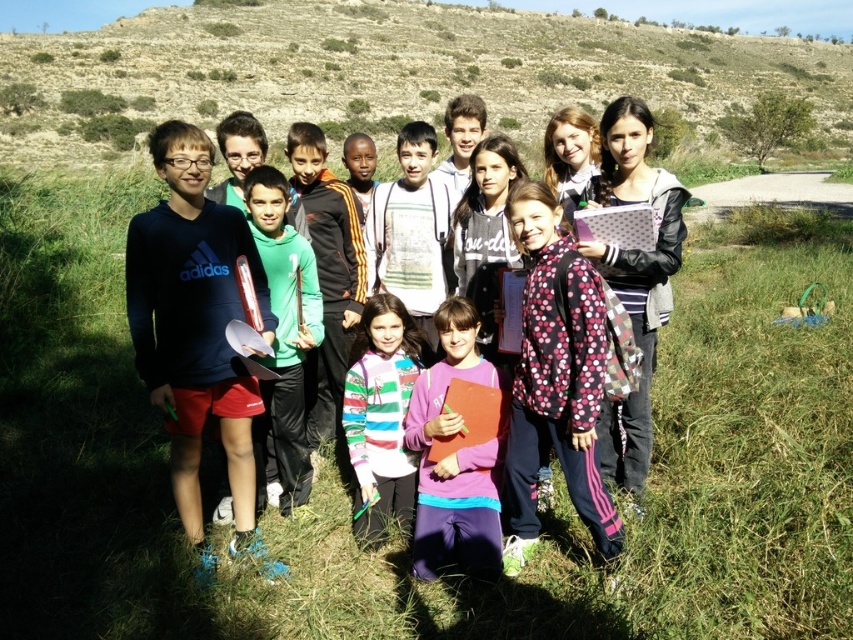
Question: Which point is closer to the camera?

Choices:
 (A) blue adidas shirt at left
 (B) pink polka dot jacket at center

Answer: (B)

Question: Does pink dotted jacket at center have a smaller size compared to green fleece jacket at center?

Choices:
 (A) yes
 (B) no

Answer: (B)

Question: Does pink dotted jacket at center lie behind striped sweater at center?

Choices:
 (A) yes
 (B) no

Answer: (B)

Question: Which point appears farthest from the camera in this image?

Choices:
 (A) (604, 509)
 (B) (444, 477)
 (C) (265, 225)

Answer: (C)

Question: Which of these objects is positioned farthest from the pink dotted jacket at center?

Choices:
 (A) pink polka dot jacket at center
 (B) blue adidas shirt at left
 (C) striped sweater at center

Answer: (B)

Question: Does blue adidas shirt at left appear over pink dotted jacket at center?

Choices:
 (A) yes
 (B) no

Answer: (B)